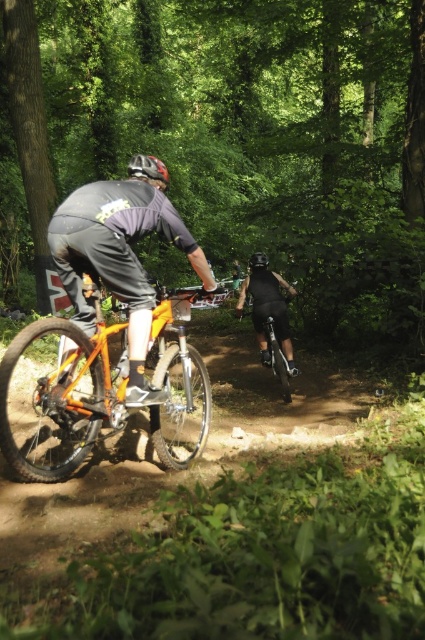
Question: Can you confirm if orange matte dirt bike at left is positioned to the left of orange matte bicycle at center?

Choices:
 (A) no
 (B) yes

Answer: (A)

Question: Does matte black helmet at center have a larger size compared to black matte bicycle helmet at center?

Choices:
 (A) yes
 (B) no

Answer: (A)

Question: Estimate the real-world distances between objects in this image. Which object is closer to the shiny black bicycle at center?

Choices:
 (A) matte black helmet at center
 (B) black matte bicycle helmet at center

Answer: (B)

Question: Does matte black helmet at center have a lesser width compared to black matte bicycle helmet at center?

Choices:
 (A) yes
 (B) no

Answer: (B)

Question: Among these points, which one is farthest from the camera?

Choices:
 (A) (132, 166)
 (B) (257, 252)

Answer: (B)

Question: Which of the following is the closest to the observer?

Choices:
 (A) (99, 256)
 (B) (150, 412)

Answer: (A)